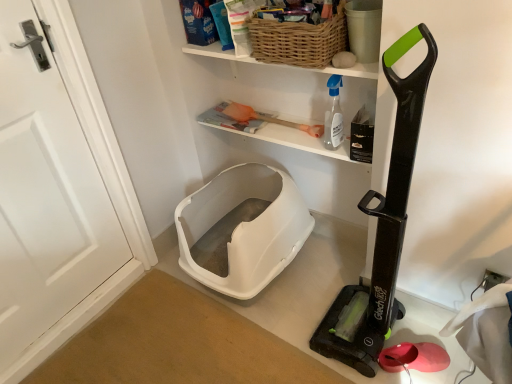
Question: Can we say transparent plastic spray bottle at upper center lies outside woven brown basket at upper center?

Choices:
 (A) no
 (B) yes

Answer: (B)

Question: Considering the relative sizes of transparent plastic spray bottle at upper center and woven brown basket at upper center in the image provided, is transparent plastic spray bottle at upper center wider than woven brown basket at upper center?

Choices:
 (A) yes
 (B) no

Answer: (B)

Question: From the image's perspective, is transparent plastic spray bottle at upper center located above woven brown basket at upper center?

Choices:
 (A) yes
 (B) no

Answer: (B)

Question: Considering the relative positions of transparent plastic spray bottle at upper center and woven brown basket at upper center in the image provided, is transparent plastic spray bottle at upper center to the left of woven brown basket at upper center from the viewer's perspective?

Choices:
 (A) no
 (B) yes

Answer: (A)

Question: From a real-world perspective, is transparent plastic spray bottle at upper center located higher than woven brown basket at upper center?

Choices:
 (A) no
 (B) yes

Answer: (A)

Question: Does transparent plastic spray bottle at upper center have a greater height compared to woven brown basket at upper center?

Choices:
 (A) no
 (B) yes

Answer: (B)

Question: Is there a large distance between woven brown basket at upper center and black plastic vacuum cleaner at right?

Choices:
 (A) yes
 (B) no

Answer: (B)

Question: Could you tell me if woven brown basket at upper center is facing black plastic vacuum cleaner at right?

Choices:
 (A) no
 (B) yes

Answer: (A)

Question: From the image's perspective, does woven brown basket at upper center appear higher than black plastic vacuum cleaner at right?

Choices:
 (A) yes
 (B) no

Answer: (A)

Question: Is woven brown basket at upper center bigger than black plastic vacuum cleaner at right?

Choices:
 (A) no
 (B) yes

Answer: (A)

Question: Does woven brown basket at upper center have a lesser width compared to black plastic vacuum cleaner at right?

Choices:
 (A) yes
 (B) no

Answer: (A)

Question: From a real-world perspective, is woven brown basket at upper center physically below black plastic vacuum cleaner at right?

Choices:
 (A) no
 (B) yes

Answer: (A)

Question: Considering the relative sizes of white plastic litter box at lower center and transparent plastic spray bottle at upper center in the image provided, is white plastic litter box at lower center taller than transparent plastic spray bottle at upper center?

Choices:
 (A) no
 (B) yes

Answer: (B)